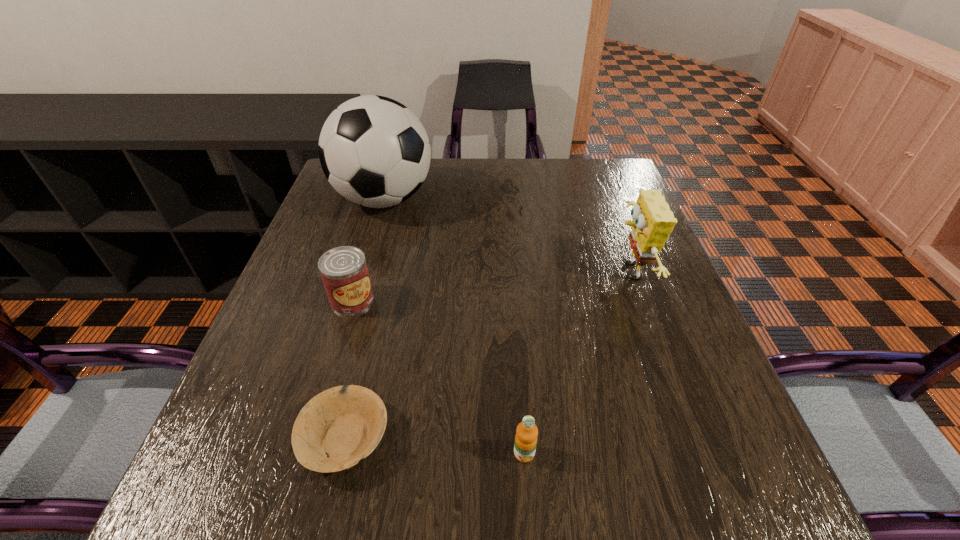
Find the location of a particular element. the tallest object is located at coordinates point(374,151).

I want to click on soccer ball, so click(374, 151).

Locate an element on the screen. This screenshot has height=540, width=960. sponge is located at coordinates (x=653, y=221).

Locate an element on the screen. the fourth shortest object is located at coordinates (653, 221).

Find the location of `can`. can is located at coordinates (344, 272).

Find the location of a particular element. orange juice is located at coordinates (526, 435).

At what (x,y) coordinates should I click in order to perform the action: click on the shortest object. Please return your answer as a coordinate pair (x, y). The height and width of the screenshot is (540, 960). Looking at the image, I should click on (335, 429).

Identify the location of vacant region located 0.050m on the back of the farthest object. point(394,166).

Locate an element on the screen. The image size is (960, 540). free spot located on the face of the sponge is located at coordinates (446, 272).

Find the location of a particular element. free space located 0.160m on the face of the sponge is located at coordinates (542, 272).